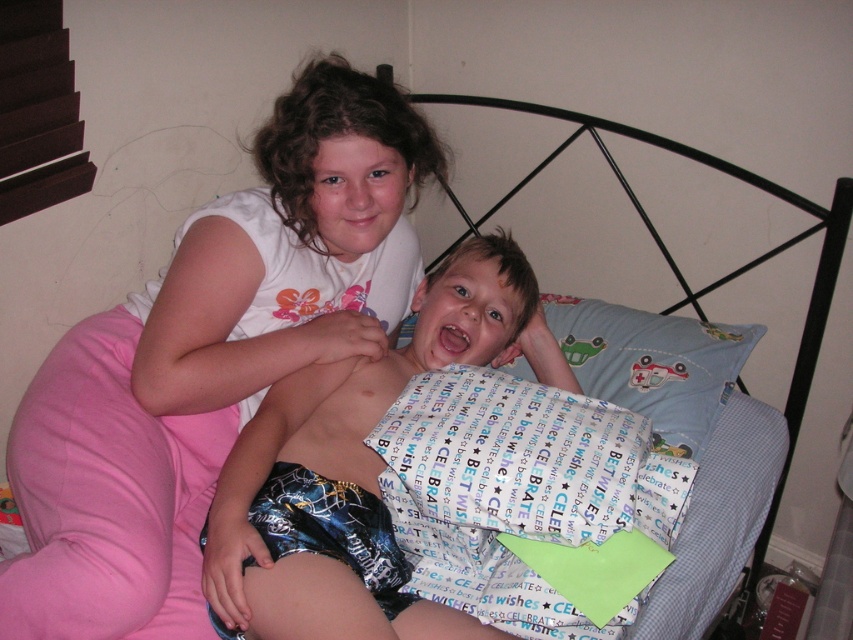
Question: Is blue printed shorts at center thinner than blue fabric pillow at upper center?

Choices:
 (A) no
 (B) yes

Answer: (A)

Question: Which point appears closest to the camera in this image?

Choices:
 (A) (672, 440)
 (B) (305, 387)

Answer: (B)

Question: Can you confirm if blue printed shorts at center is positioned below blue fabric pillow at upper center?

Choices:
 (A) no
 (B) yes

Answer: (B)

Question: Does blue printed shorts at center appear on the left side of blue fabric pillow at upper center?

Choices:
 (A) yes
 (B) no

Answer: (A)

Question: Which of the following is the farthest from the observer?

Choices:
 (A) blue fabric pillow at upper center
 (B) blue printed shorts at center

Answer: (A)